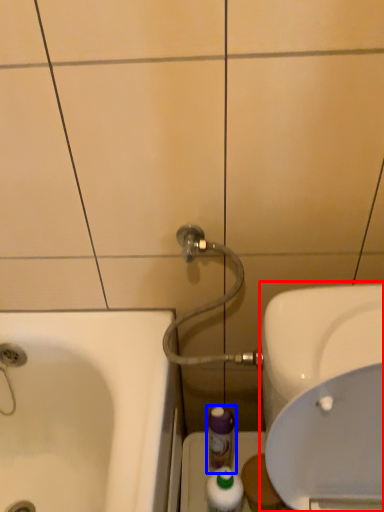
Question: Which object appears farthest to the camera in this image, sink (highlighted by a red box) or mouthwash (highlighted by a blue box)?

Choices:
 (A) sink
 (B) mouthwash

Answer: (B)